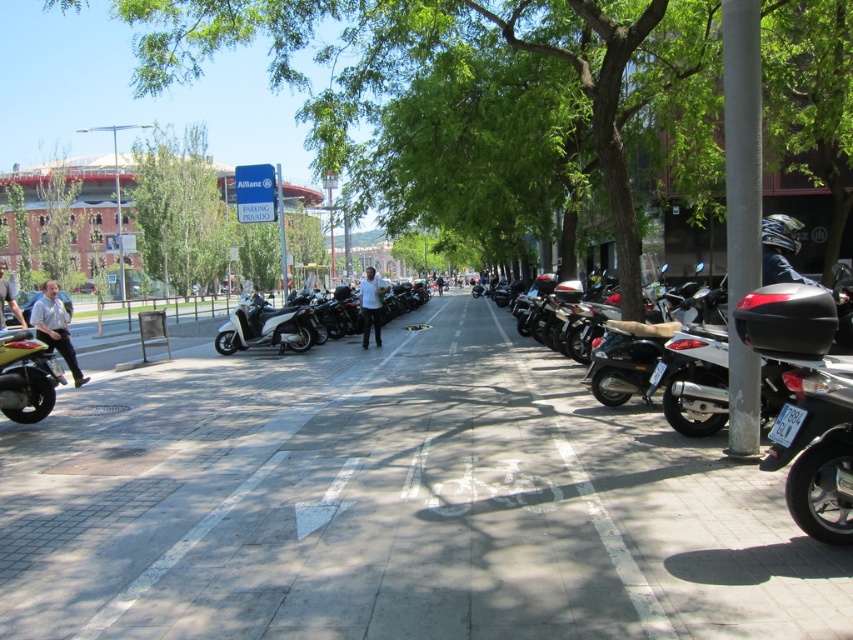
Question: Which is farther from the green leafy tree at center?

Choices:
 (A) shiny black motorcycle at left
 (B) light brown leather jacket at left
 (C) black matte motorcycle at right

Answer: (B)

Question: Which point is closer to the camera?

Choices:
 (A) (19, 320)
 (B) (252, 333)
 (C) (706, 396)
 (D) (165, 461)

Answer: (D)

Question: Does gray concrete pavement at center lie in front of light blue shirt at left?

Choices:
 (A) yes
 (B) no

Answer: (A)

Question: Which of the following is the farthest from the observer?

Choices:
 (A) shiny black motorcycle at left
 (B) light brown leather jacket at left

Answer: (B)

Question: Is shiny black motorcycle at left positioned behind light brown leather jacket at left?

Choices:
 (A) no
 (B) yes

Answer: (A)

Question: Is gray concrete pavement at center above white matte shirt at center?

Choices:
 (A) yes
 (B) no

Answer: (B)